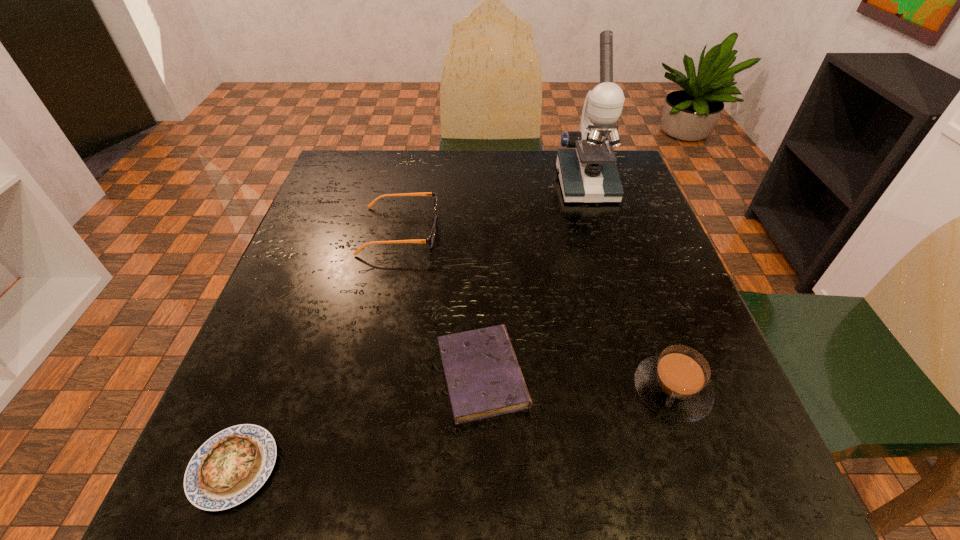
Where is `free space between the second farthest object and the farthest object`? free space between the second farthest object and the farthest object is located at coordinates (492, 207).

The height and width of the screenshot is (540, 960). What are the coordinates of `empty space between the diary and the tallest object` in the screenshot? It's located at (534, 279).

Find the location of `blank region between the fourth nearest object and the tallest object`. blank region between the fourth nearest object and the tallest object is located at coordinates (492, 207).

Identify the location of free point between the tallest object and the diary. (534, 279).

Where is `empty location between the farthest object and the nearest object`? empty location between the farthest object and the nearest object is located at coordinates (410, 326).

This screenshot has width=960, height=540. Identify the location of vacant space that's between the spectacles and the microscope. pos(492,207).

Identify the location of object that is the second closest one to the third object from left to right. The height and width of the screenshot is (540, 960). (430, 240).

Identify which object is the fourth closest to the fourth object from right to left. Please provide its 2D coordinates. Your answer should be formatted as a tuple, i.e. [(x, y)], where the tuple contains the x and y coordinates of a point satisfying the conditions above.

[(675, 384)]

The height and width of the screenshot is (540, 960). Find the location of `vacant space that satisfies the following two spatial constraints: 1. on the front-facing side of the third object from left to right; 2. on the left side of the fourth object from right to left`. vacant space that satisfies the following two spatial constraints: 1. on the front-facing side of the third object from left to right; 2. on the left side of the fourth object from right to left is located at coordinates (371, 375).

You are a GUI agent. You are given a task and a screenshot of the screen. Output one action in this format:
    pyautogui.click(x=<x>, y=<y>)
    Task: Click on the vacant region that satisfies the following two spatial constraints: 1. on the front-facing side of the third tallest object; 2. on the back side of the fourth shortest object
    
    Given the screenshot: What is the action you would take?
    pyautogui.click(x=368, y=390)